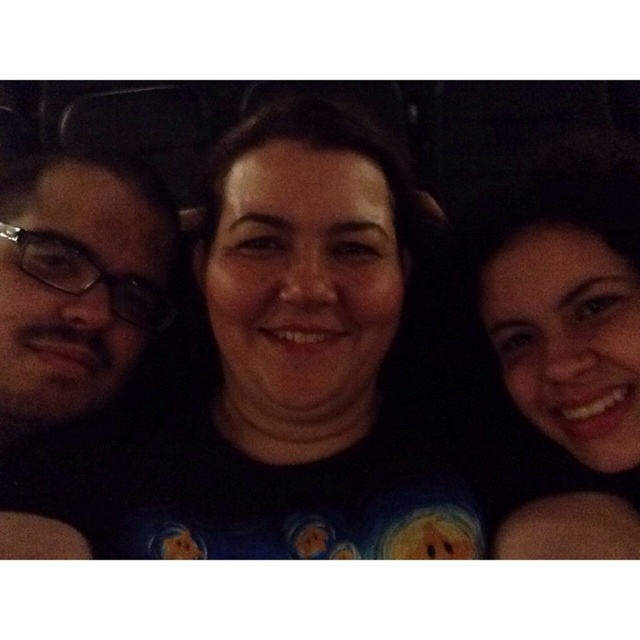
You are a photographer trying to adjust the lighting for a photo shoot. You notice the black matte shirt at center and the transparent plastic glasses at left in the frame. Which object should you focus your light on to ensure it stands out more, considering their sizes?

The black matte shirt at center is bigger than the transparent plastic glasses at left, so focusing the light on the black matte shirt at center would make it stand out more due to its larger size.

You are a photographer adjusting the focus on your camera. You want to ensure that the black matte shirt at center is in sharp focus. Given that your camera has a depth of field range of 18 inches, what should you do?

The black matte shirt at center is 20.89 inches away from the camera, which is slightly beyond the depth of field range of 18 inches. To ensure it is in focus, adjust the camera settings to increase the depth of field or move closer to the subject so the distance becomes within the 18 inches range.

You are taking a photo of three people standing in a dark room. You notice two points in the image labeled as point 1 at coordinates point (358, 404) and point 2 at coordinates point (32, 234). Which point is closer to the camera?

Point (358, 404) is closer to the camera than point (32, 234).